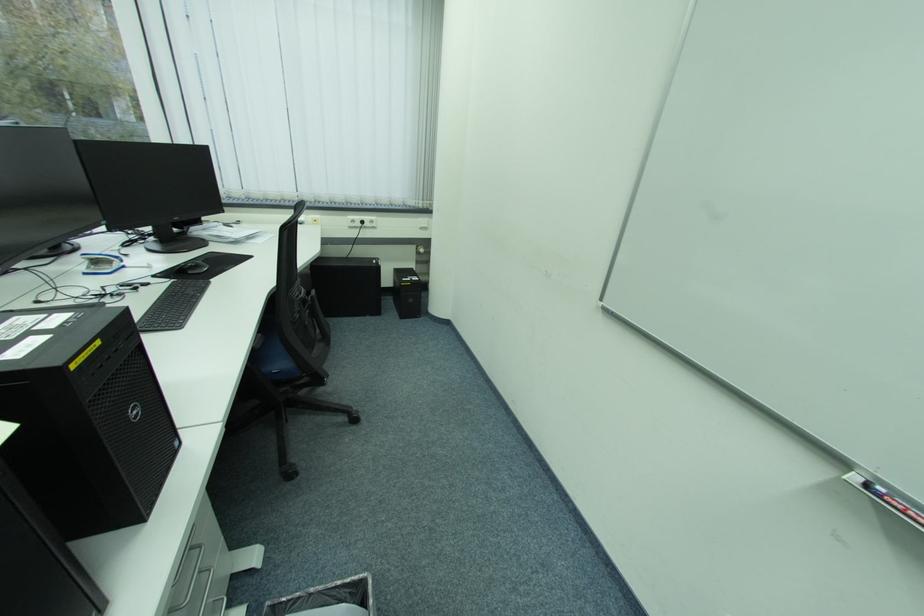
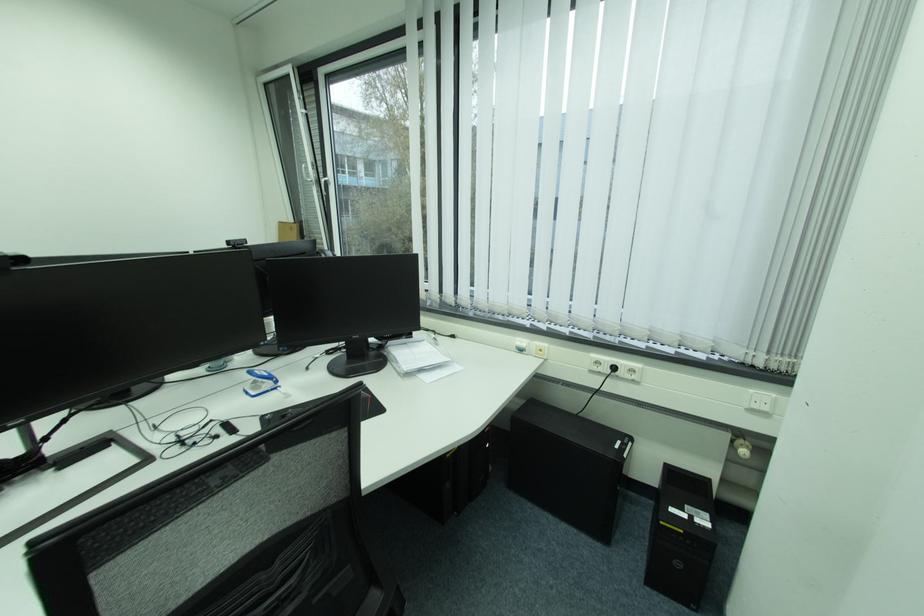
Where in the second image is the point corresponding to (x=371, y=223) from the first image?

(623, 369)